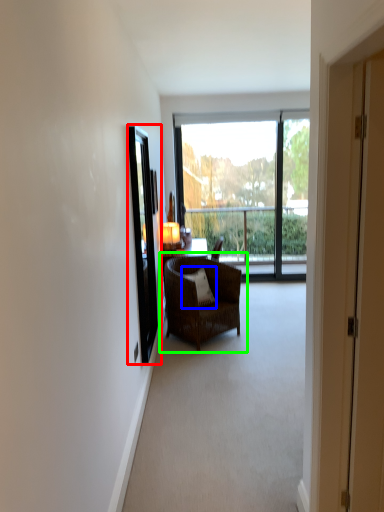
Question: Based on their relative distances, which object is nearer to screen door (highlighted by a red box)? Choose from pillow (highlighted by a blue box) and chair (highlighted by a green box).

Choices:
 (A) pillow
 (B) chair

Answer: (B)